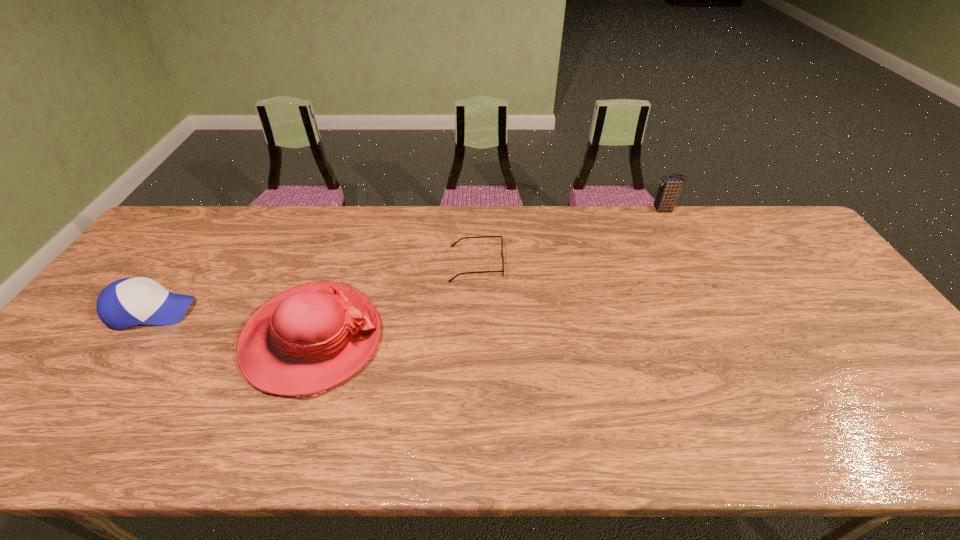
Find the location of a particular element. Image resolution: width=960 pixels, height=540 pixels. vacant region located 0.290m at the front of the hat with a bow is located at coordinates (494, 340).

You are a GUI agent. You are given a task and a screenshot of the screen. Output one action in this format:
    pyautogui.click(x=<x>, y=<y>)
    Task: Click on the vacant space situated 0.090m on the front-facing side of the baseball cap
    The image size is (960, 540).
    Given the screenshot: What is the action you would take?
    227,311

This screenshot has height=540, width=960. I want to click on vacant space positioned on the front-facing side of the third nearest object, so click(533, 264).

Find the location of a particular element. The image size is (960, 540). clutch bag present at the far edge is located at coordinates (669, 188).

Where is `spectacles located at the far edge`? Image resolution: width=960 pixels, height=540 pixels. spectacles located at the far edge is located at coordinates (452, 245).

Locate an element on the screen. The width and height of the screenshot is (960, 540). object at the left edge is located at coordinates (127, 302).

Find the location of a particular element. The height and width of the screenshot is (540, 960). vacant space at the far edge of the desktop is located at coordinates (506, 227).

Where is `free space at the near edge of the desktop`? free space at the near edge of the desktop is located at coordinates (311, 448).

What are the coordinates of `free space at the left edge` in the screenshot? It's located at (91, 397).

In the image, there is a desktop. At what (x,y) coordinates should I click in order to perform the action: click on free space at the right edge. Please return your answer as a coordinate pair (x, y). The image size is (960, 540). Looking at the image, I should click on (804, 301).